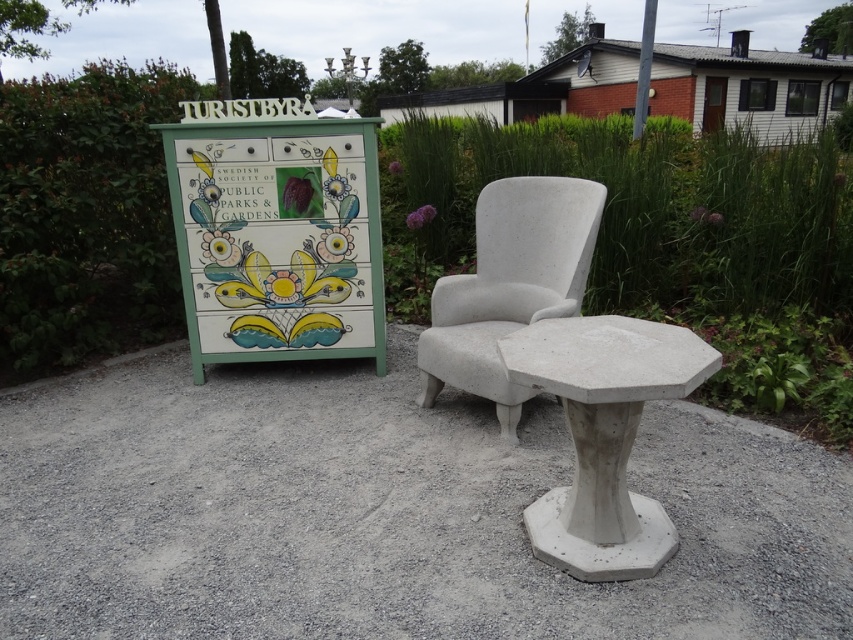
Which is above, green textured hedge at left or concrete/stone stool at center?

green textured hedge at left is higher up.

At what (x,y) coordinates should I click in order to perform the action: click on green textured hedge at left. Please return your answer as a coordinate pair (x, y). The width and height of the screenshot is (853, 640). Looking at the image, I should click on (86, 212).

Which is more to the right, gray concrete table at center or concrete/stone stool at center?

Positioned to the right is concrete/stone stool at center.

Is the position of gray concrete table at center more distant than that of concrete/stone stool at center?

Yes, gray concrete table at center is behind concrete/stone stool at center.

The width and height of the screenshot is (853, 640). What do you see at coordinates (386, 513) in the screenshot?
I see `gray concrete table at center` at bounding box center [386, 513].

This screenshot has height=640, width=853. Identify the location of gray concrete table at center. (386, 513).

Can you confirm if gray concrete table at center is positioned below green textured hedge at left?

Correct, gray concrete table at center is located below green textured hedge at left.

Which of these two, gray concrete table at center or green textured hedge at left, stands shorter?

gray concrete table at center is shorter.

Image resolution: width=853 pixels, height=640 pixels. What do you see at coordinates (386, 513) in the screenshot? I see `gray concrete table at center` at bounding box center [386, 513].

Locate an element on the screen. gray concrete table at center is located at coordinates tap(386, 513).